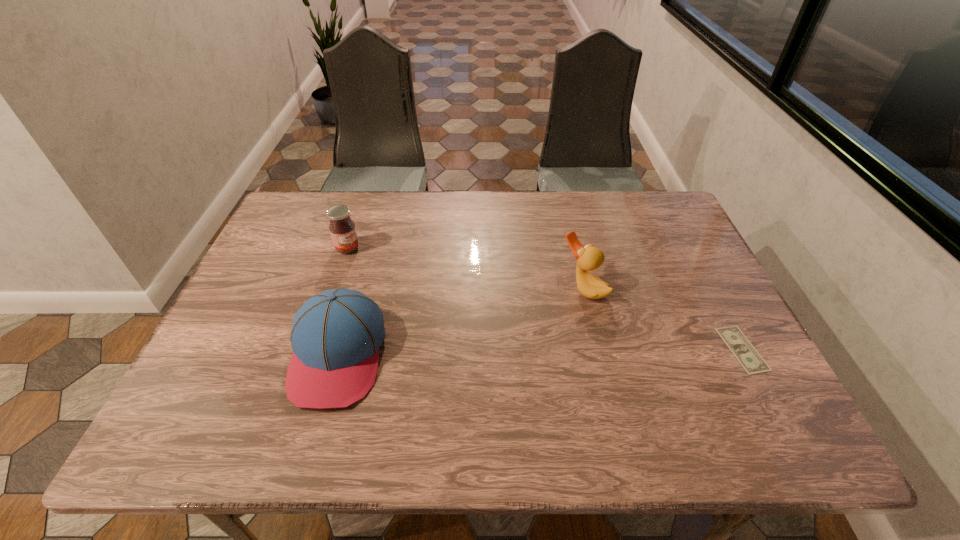
This screenshot has width=960, height=540. I want to click on vacant point located between the duck and the rightmost object, so click(662, 319).

This screenshot has width=960, height=540. I want to click on free space between the shortest object and the duck, so click(662, 319).

Locate an element on the screen. This screenshot has height=540, width=960. free space between the shortest object and the baseball cap is located at coordinates (540, 352).

Choose which object is the second nearest neighbor to the baseball cap. Please provide its 2D coordinates. Your answer should be formatted as a tuple, i.e. [(x, y)], where the tuple contains the x and y coordinates of a point satisfying the conditions above.

[(589, 258)]

Locate which object is the second closest to the duck. Please provide its 2D coordinates. Your answer should be formatted as a tuple, i.e. [(x, y)], where the tuple contains the x and y coordinates of a point satisfying the conditions above.

[(336, 335)]

The height and width of the screenshot is (540, 960). Find the location of `free spot that satisfies the following two spatial constraints: 1. on the front side of the farthest object; 2. on the left side of the money`. free spot that satisfies the following two spatial constraints: 1. on the front side of the farthest object; 2. on the left side of the money is located at coordinates (314, 349).

At what (x,y) coordinates should I click in order to perform the action: click on free space that satisfies the following two spatial constraints: 1. on the front side of the jam; 2. on the right side of the duck. Please return your answer as a coordinate pair (x, y). Image resolution: width=960 pixels, height=540 pixels. Looking at the image, I should click on (334, 288).